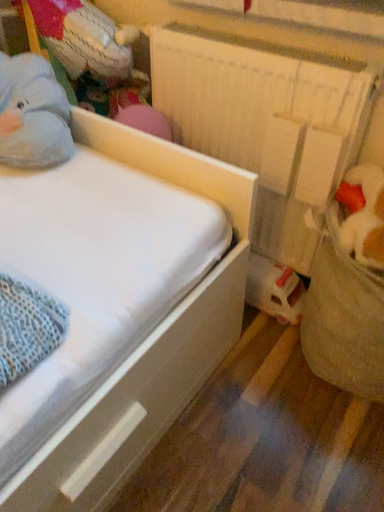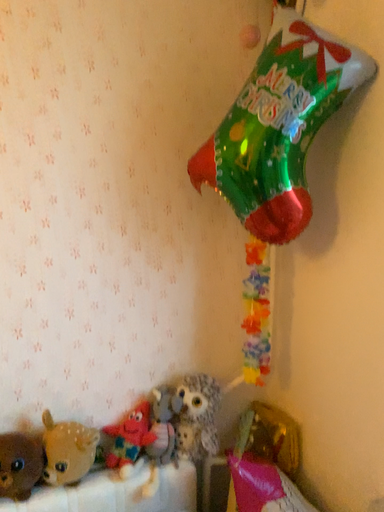
Question: Which way did the camera rotate in the video?

Choices:
 (A) rotated right
 (B) rotated left

Answer: (B)